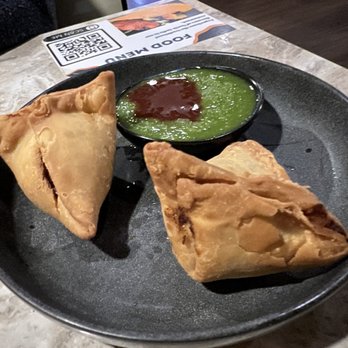
You are a GUI agent. You are given a task and a screenshot of the screen. Output one action in this format:
    pyautogui.click(x=<x>, y=<y>)
    Task: Click on the shadow below plate
    
    Given the screenshot: What is the action you would take?
    pyautogui.click(x=335, y=304)